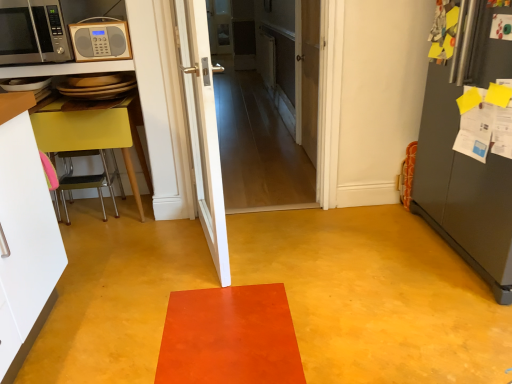
Image resolution: width=512 pixels, height=384 pixels. Describe the element at coordinates (202, 127) in the screenshot. I see `white glossy door at center, acting as the third door starting from the back` at that location.

Describe the element at coordinates (310, 75) in the screenshot. I see `wooden door at center, marked as the third door in a front-to-back arrangement` at that location.

The image size is (512, 384). What do you see at coordinates (32, 32) in the screenshot? I see `silver metallic microwave at upper left, the first microwave oven from the left` at bounding box center [32, 32].

This screenshot has height=384, width=512. I want to click on silver metallic microwave at upper left, the first microwave oven from the left, so click(x=32, y=32).

This screenshot has height=384, width=512. I want to click on white glossy door at center, which appears as the first door when viewed from the front, so click(202, 127).

From the image's perspective, is silver metallic microwave at upper left, the first microwave oven from the left, located above matte silver microwave at upper left, marked as the 1th microwave oven in a right-to-left arrangement?

Yes, from the image's perspective, silver metallic microwave at upper left, the first microwave oven from the left, is above matte silver microwave at upper left, marked as the 1th microwave oven in a right-to-left arrangement.

Is silver metallic microwave at upper left, marked as the 2th microwave oven in a right-to-left arrangement, far from matte silver microwave at upper left, marked as the 1th microwave oven in a right-to-left arrangement?

No.

Does silver metallic microwave at upper left, marked as the 2th microwave oven in a right-to-left arrangement, have a greater width compared to matte silver microwave at upper left, marked as the 1th microwave oven in a right-to-left arrangement?

Yes, silver metallic microwave at upper left, marked as the 2th microwave oven in a right-to-left arrangement, is wider than matte silver microwave at upper left, marked as the 1th microwave oven in a right-to-left arrangement.

Looking at this image, is matte silver microwave at upper left, the 2th microwave oven positioned from the left, positioned before silver metallic microwave at upper left, the first microwave oven from the left?

No.

Is point (88, 48) closer or farther from the camera than point (48, 2)?

Point (88, 48).

Consider the image. Does matte silver microwave at upper left, marked as the 1th microwave oven in a right-to-left arrangement, contain silver metallic microwave at upper left, marked as the 2th microwave oven in a right-to-left arrangement?

No, silver metallic microwave at upper left, marked as the 2th microwave oven in a right-to-left arrangement, is not inside matte silver microwave at upper left, marked as the 1th microwave oven in a right-to-left arrangement.

In terms of width, does white wooden door at center, the 2th door positioned from the front, look wider or thinner when compared to matte silver microwave at upper left, the 2th microwave oven positioned from the left?

Clearly, white wooden door at center, the 2th door positioned from the front, has less width compared to matte silver microwave at upper left, the 2th microwave oven positioned from the left.

Looking at this image, in the image, is white wooden door at center, the 2th door positioned from the front, on the left side or the right side of matte silver microwave at upper left, marked as the 1th microwave oven in a right-to-left arrangement?

From the image, it's evident that white wooden door at center, the 2th door positioned from the front, is to the right of matte silver microwave at upper left, marked as the 1th microwave oven in a right-to-left arrangement.

Which is in front, white wooden door at center, the 2th door positioned from the front, or matte silver microwave at upper left, marked as the 1th microwave oven in a right-to-left arrangement?

Positioned in front is white wooden door at center, the 2th door positioned from the front.

Looking at this image, from a real-world perspective, is white wooden door at center, which is counted as the 2th door, starting from the back, above or below matte silver microwave at upper left, the 2th microwave oven positioned from the left?

Clearly, from a real-world perspective, white wooden door at center, which is counted as the 2th door, starting from the back, is below matte silver microwave at upper left, the 2th microwave oven positioned from the left.

Does yellow matte table at left have a smaller size compared to matte silver microwave at upper left, marked as the 1th microwave oven in a right-to-left arrangement?

Incorrect, yellow matte table at left is not smaller in size than matte silver microwave at upper left, marked as the 1th microwave oven in a right-to-left arrangement.

Find the location of a particular element. This screenshot has height=384, width=512. table on the left of matte silver microwave at upper left, the 2th microwave oven positioned from the left is located at coordinates (94, 131).

Which object is wider, yellow matte table at left or matte silver microwave at upper left, the 2th microwave oven positioned from the left?

With larger width is yellow matte table at left.

Which of these two, yellow matte table at left or matte silver microwave at upper left, the 2th microwave oven positioned from the left, stands shorter?

With less height is matte silver microwave at upper left, the 2th microwave oven positioned from the left.

Measure the distance from silver metallic microwave at upper left, marked as the 2th microwave oven in a right-to-left arrangement, to white glossy door at center, acting as the third door starting from the back.

silver metallic microwave at upper left, marked as the 2th microwave oven in a right-to-left arrangement, is 31.19 inches from white glossy door at center, acting as the third door starting from the back.

From the image's perspective, would you say silver metallic microwave at upper left, the first microwave oven from the left, is shown under white glossy door at center, acting as the third door starting from the back?

No, from the image's perspective, silver metallic microwave at upper left, the first microwave oven from the left, is not beneath white glossy door at center, acting as the third door starting from the back.

Do you think silver metallic microwave at upper left, marked as the 2th microwave oven in a right-to-left arrangement, is within white glossy door at center, which appears as the first door when viewed from the front, or outside of it?

silver metallic microwave at upper left, marked as the 2th microwave oven in a right-to-left arrangement, is not enclosed by white glossy door at center, which appears as the first door when viewed from the front.

Is silver metallic microwave at upper left, marked as the 2th microwave oven in a right-to-left arrangement, placed right next to white glossy door at center, which appears as the first door when viewed from the front?

No, silver metallic microwave at upper left, marked as the 2th microwave oven in a right-to-left arrangement, is not making contact with white glossy door at center, which appears as the first door when viewed from the front.

Which point is more distant from viewer, (193, 96) or (308, 32)?

The point (308, 32) is farther.

From the image's perspective, which one is positioned higher, white glossy door at center, which appears as the first door when viewed from the front, or white wooden door at center, the 2th door positioned from the front?

white wooden door at center, the 2th door positioned from the front, appears higher in the image.

Considering the relative sizes of white glossy door at center, acting as the third door starting from the back, and white wooden door at center, which is counted as the 2th door, starting from the back, in the image provided, is white glossy door at center, acting as the third door starting from the back, shorter than white wooden door at center, which is counted as the 2th door, starting from the back,?

Incorrect, the height of white glossy door at center, acting as the third door starting from the back, does not fall short of that of white wooden door at center, which is counted as the 2th door, starting from the back.

Who is smaller, white glossy door at center, which appears as the first door when viewed from the front, or white wooden door at center, the 2th door positioned from the front?

Smaller between the two is white wooden door at center, the 2th door positioned from the front.

Considering the sizes of white glossy door at center, which appears as the first door when viewed from the front, and yellow matte table at left in the image, is white glossy door at center, which appears as the first door when viewed from the front, taller or shorter than yellow matte table at left?

white glossy door at center, which appears as the first door when viewed from the front, is taller than yellow matte table at left.

What's the angular difference between white glossy door at center, which appears as the first door when viewed from the front, and yellow matte table at left's facing directions?

They differ by 100 degrees in their facing directions.

From the image's perspective, relative to yellow matte table at left, is white glossy door at center, which appears as the first door when viewed from the front, above or below?

From the image's perspective, white glossy door at center, which appears as the first door when viewed from the front, appears above yellow matte table at left.

Locate an element on the screen. The height and width of the screenshot is (384, 512). microwave oven below the silver metallic microwave at upper left, marked as the 2th microwave oven in a right-to-left arrangement (from a real-world perspective) is located at coordinates (100, 39).

In order to click on microwave oven on the left of matte silver microwave at upper left, the 2th microwave oven positioned from the left in this screenshot , I will do `click(32, 32)`.

Based on the photo, from the image, which object appears to be nearer to white glossy door at center, which appears as the first door when viewed from the front, yellow matte table at left or silver metallic microwave at upper left, the first microwave oven from the left?

yellow matte table at left is positioned closer to the anchor white glossy door at center, which appears as the first door when viewed from the front.

Based on their spatial positions, is wooden door at center, marked as the third door in a front-to-back arrangement, or white wooden door at center, the 2th door positioned from the front, further from yellow matte table at left?

Among the two, wooden door at center, marked as the third door in a front-to-back arrangement, is located further to yellow matte table at left.

Based on their spatial positions, is white glossy door at center, acting as the third door starting from the back, or matte silver microwave at upper left, marked as the 1th microwave oven in a right-to-left arrangement, closer to wooden door at center, which is the first door in back-to-front order?

The object closer to wooden door at center, which is the first door in back-to-front order, is white glossy door at center, acting as the third door starting from the back.

Based on their spatial positions, is white glossy door at center, acting as the third door starting from the back, or yellow matte table at left further from white wooden door at center, which is counted as the 2th door, starting from the back?

Among the two, white glossy door at center, acting as the third door starting from the back, is located further to white wooden door at center, which is counted as the 2th door, starting from the back.

Based on their spatial positions, is silver metallic microwave at upper left, the first microwave oven from the left, or wooden door at center, which is the first door in back-to-front order, further from yellow matte table at left?

wooden door at center, which is the first door in back-to-front order, is further to yellow matte table at left.

When comparing their distances from wooden door at center, which is the first door in back-to-front order, does matte silver microwave at upper left, marked as the 1th microwave oven in a right-to-left arrangement, or white glossy door at center, which appears as the first door when viewed from the front, seem closer?

Based on the image, white glossy door at center, which appears as the first door when viewed from the front, appears to be nearer to wooden door at center, which is the first door in back-to-front order.

Consider the image. Estimate the real-world distances between objects in this image. Which object is closer to white wooden door at center, which is counted as the 2th door, starting from the back, yellow matte table at left or silver metallic microwave at upper left, marked as the 2th microwave oven in a right-to-left arrangement?

yellow matte table at left.

Consider the image. From the image, which object appears to be farther from wooden door at center, marked as the third door in a front-to-back arrangement, white wooden door at center, which is counted as the 2th door, starting from the back, or matte silver microwave at upper left, marked as the 1th microwave oven in a right-to-left arrangement?

The object further to wooden door at center, marked as the third door in a front-to-back arrangement, is matte silver microwave at upper left, marked as the 1th microwave oven in a right-to-left arrangement.

The image size is (512, 384). I want to click on microwave oven situated between yellow matte table at left and wooden door at center, which is the first door in back-to-front order, from left to right, so [100, 39].

In order to click on microwave oven between silver metallic microwave at upper left, marked as the 2th microwave oven in a right-to-left arrangement, and yellow matte table at left, in the vertical direction in this screenshot , I will do `click(100, 39)`.

Identify the location of microwave oven located between silver metallic microwave at upper left, marked as the 2th microwave oven in a right-to-left arrangement, and wooden door at center, marked as the third door in a front-to-back arrangement, in the left-right direction. (100, 39).

Locate an element on the screen. This screenshot has width=512, height=384. table between silver metallic microwave at upper left, the first microwave oven from the left, and white glossy door at center, which appears as the first door when viewed from the front, in the horizontal direction is located at coordinates (94, 131).